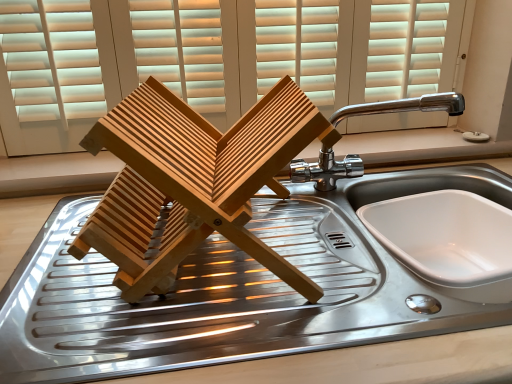
Question: Is wooden blinds at upper center to the left or to the right of white glossy sink at lower right in the image?

Choices:
 (A) left
 (B) right

Answer: (A)

Question: Considering the positions of wooden blinds at upper center and white glossy sink at lower right in the image, is wooden blinds at upper center wider or thinner than white glossy sink at lower right?

Choices:
 (A) thin
 (B) wide

Answer: (A)

Question: Which object is the farthest from the white glossy sink at lower right?

Choices:
 (A) chrome metallic faucet at upper right
 (B) wooden blinds at upper center

Answer: (B)

Question: Based on their relative distances, which object is nearer to the wooden blinds at upper center?

Choices:
 (A) chrome metallic faucet at upper right
 (B) white glossy sink at lower right

Answer: (A)